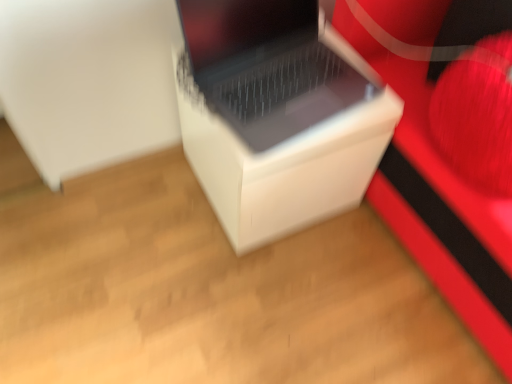
Question: Is white matte cardboard box at center not within white plastic laptop at center?

Choices:
 (A) yes
 (B) no

Answer: (A)

Question: From the image's perspective, is white matte cardboard box at center over white plastic laptop at center?

Choices:
 (A) yes
 (B) no

Answer: (B)

Question: Is white matte cardboard box at center behind white plastic laptop at center?

Choices:
 (A) no
 (B) yes

Answer: (B)

Question: Is white matte cardboard box at center at the left side of white plastic laptop at center?

Choices:
 (A) yes
 (B) no

Answer: (A)

Question: Is white matte cardboard box at center surrounding white plastic laptop at center?

Choices:
 (A) yes
 (B) no

Answer: (B)

Question: Is white matte cardboard box at center bigger or smaller than white plastic laptop at center?

Choices:
 (A) big
 (B) small

Answer: (A)

Question: Is point (373, 107) closer or farther from the camera than point (222, 11)?

Choices:
 (A) farther
 (B) closer

Answer: (A)

Question: Based on their positions, is white matte cardboard box at center located to the left or right of white plastic laptop at center?

Choices:
 (A) right
 (B) left

Answer: (B)

Question: Considering their positions, is white matte cardboard box at center located in front of or behind white plastic laptop at center?

Choices:
 (A) behind
 (B) front

Answer: (A)

Question: From the image's perspective, is white matte cardboard box at center above or below matte white speaker at center?

Choices:
 (A) below
 (B) above

Answer: (A)

Question: Considering the positions of white matte cardboard box at center and matte white speaker at center in the image, is white matte cardboard box at center bigger or smaller than matte white speaker at center?

Choices:
 (A) small
 (B) big

Answer: (A)

Question: Visually, is white matte cardboard box at center positioned to the left or to the right of matte white speaker at center?

Choices:
 (A) right
 (B) left

Answer: (B)

Question: Considering the positions of white matte cardboard box at center and matte white speaker at center in the image, is white matte cardboard box at center wider or thinner than matte white speaker at center?

Choices:
 (A) thin
 (B) wide

Answer: (A)

Question: Does point (x=257, y=129) appear closer or farther from the camera than point (x=376, y=132)?

Choices:
 (A) farther
 (B) closer

Answer: (B)

Question: Is white plastic laptop at center inside or outside of white matte cardboard box at center?

Choices:
 (A) outside
 (B) inside

Answer: (A)